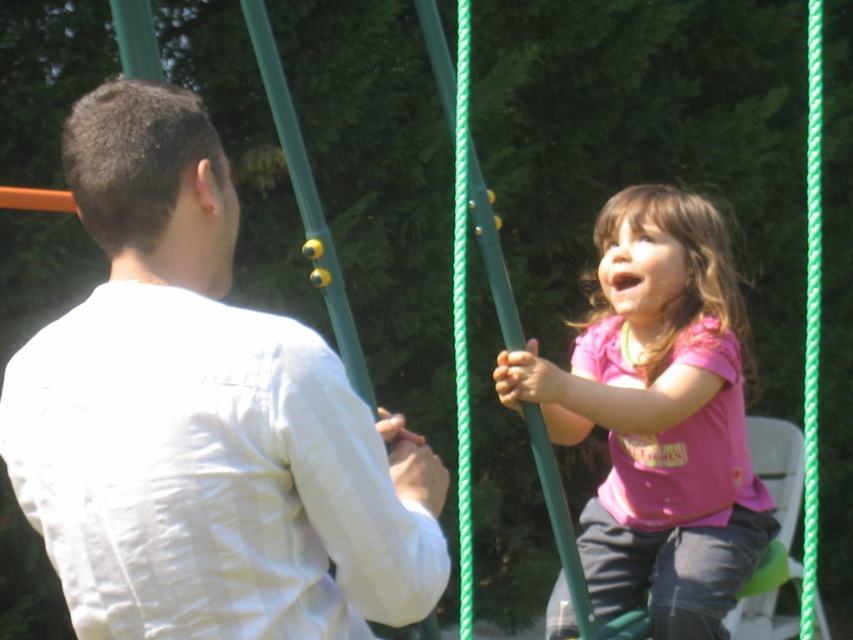
Which of these two, white cotton shirt at upper left or pink matte shirt at center, stands taller?

pink matte shirt at center

Consider the image. Which is more to the left, white cotton shirt at upper left or pink matte shirt at center?

From the viewer's perspective, white cotton shirt at upper left appears more on the left side.

Find the location of a particular element. This screenshot has height=640, width=853. white cotton shirt at upper left is located at coordinates (202, 419).